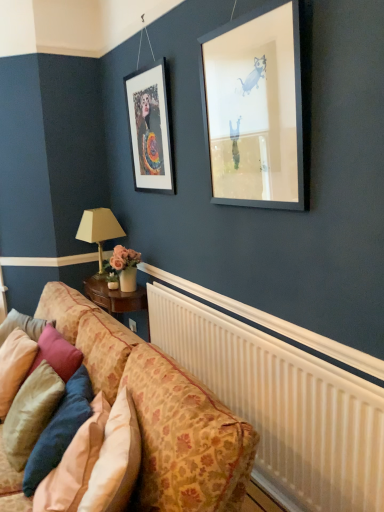
Question: Is matte black frame at upper left completely or partially inside velvet beige pillow at lower left, which is counted as the first pillow, starting from the left?

Choices:
 (A) no
 (B) yes

Answer: (A)

Question: Is velvet beige pillow at lower left, the third pillow when ordered from right to left, to the left of matte black frame at upper left from the viewer's perspective?

Choices:
 (A) no
 (B) yes

Answer: (B)

Question: From the image's perspective, is velvet beige pillow at lower left, which is counted as the first pillow, starting from the left, below matte black frame at upper left?

Choices:
 (A) yes
 (B) no

Answer: (A)

Question: Would you say velvet beige pillow at lower left, the third pillow when ordered from right to left, is outside matte black frame at upper left?

Choices:
 (A) yes
 (B) no

Answer: (A)

Question: Does velvet beige pillow at lower left, which is counted as the first pillow, starting from the left, appear on the right side of matte black frame at upper left?

Choices:
 (A) yes
 (B) no

Answer: (B)

Question: Is velvet beige pillow at lower left, which is counted as the first pillow, starting from the left, looking in the opposite direction of matte black frame at upper left?

Choices:
 (A) no
 (B) yes

Answer: (A)

Question: Can you confirm if velvet pink pillow at lower left, the 2th pillow when ordered from left to right, is taller than white plastic radiator at lower right?

Choices:
 (A) yes
 (B) no

Answer: (B)

Question: Is velvet pink pillow at lower left, marked as the 2th pillow in a right-to-left arrangement, turned away from white plastic radiator at lower right?

Choices:
 (A) no
 (B) yes

Answer: (B)

Question: Is velvet pink pillow at lower left, the 2th pillow when ordered from left to right, thinner than white plastic radiator at lower right?

Choices:
 (A) yes
 (B) no

Answer: (B)

Question: Does velvet pink pillow at lower left, the 2th pillow when ordered from left to right, have a lesser height compared to white plastic radiator at lower right?

Choices:
 (A) no
 (B) yes

Answer: (B)

Question: Is the position of velvet pink pillow at lower left, marked as the 2th pillow in a right-to-left arrangement, less distant than that of white plastic radiator at lower right?

Choices:
 (A) yes
 (B) no

Answer: (B)

Question: Are velvet pink pillow at lower left, the 2th pillow when ordered from left to right, and white plastic radiator at lower right located far from each other?

Choices:
 (A) no
 (B) yes

Answer: (A)

Question: From the image's perspective, is patterned fabric couch at lower left over velvet pink pillow at lower left, marked as the 2th pillow in a right-to-left arrangement?

Choices:
 (A) no
 (B) yes

Answer: (A)